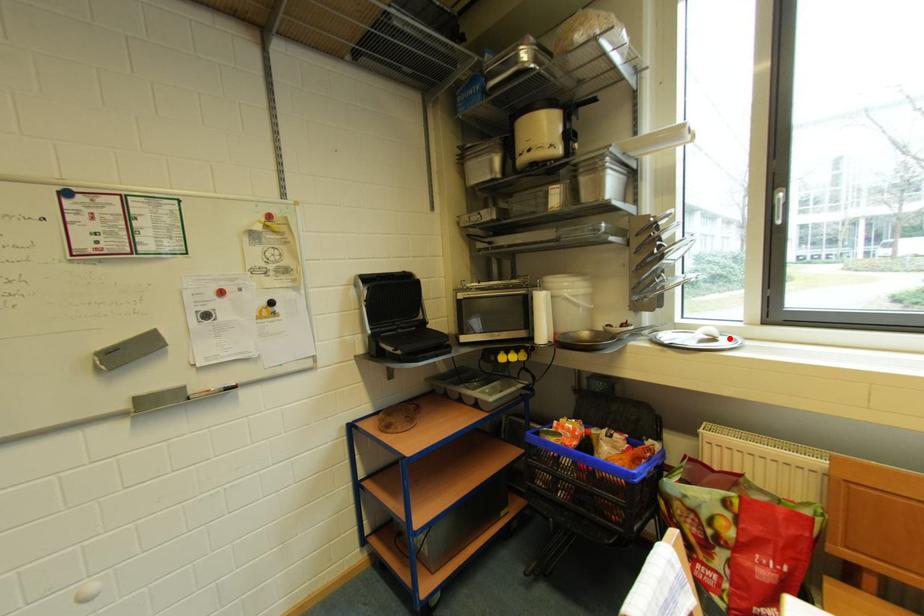
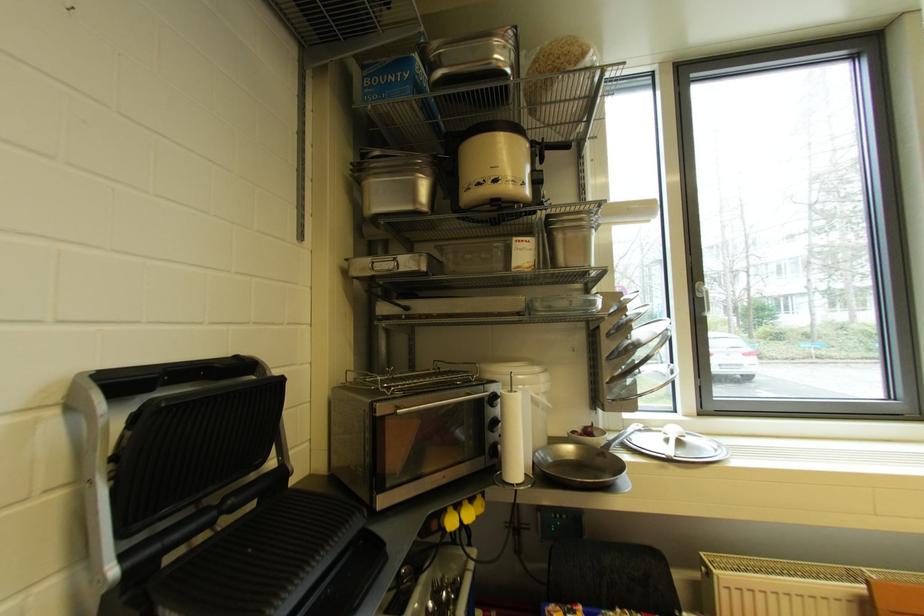
Find the pixel in the second image that matches the highlighted location in the first image.

(695, 437)